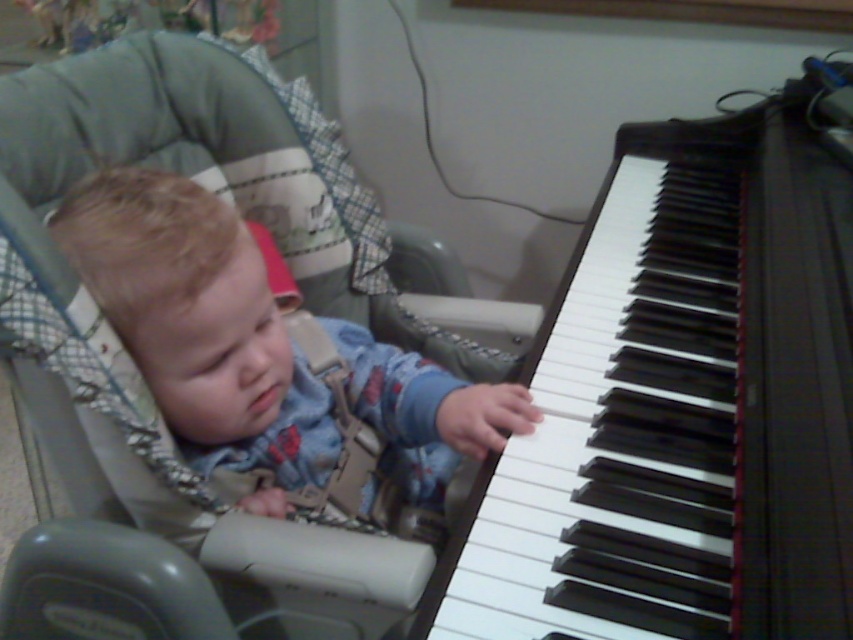
Does point (656, 156) come farther from viewer compared to point (322, 321)?

That is True.

Does white glossy piano keys at right lie behind blue denim jumpsuit at center?

That is False.

Is point (811, 342) farther from viewer compared to point (62, 234)?

No, it is in front of (62, 234).

Locate an element on the screen. This screenshot has height=640, width=853. white glossy piano keys at right is located at coordinates (682, 403).